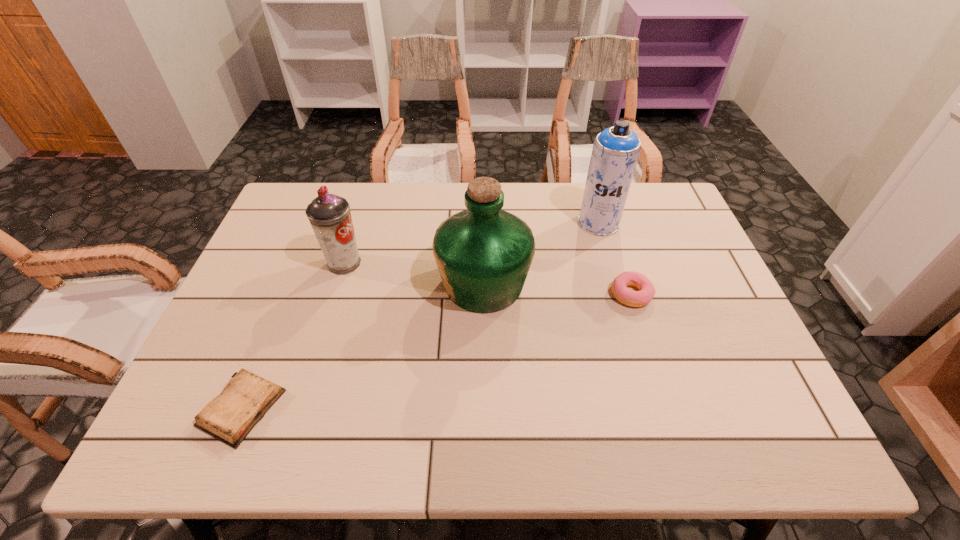
Find the location of a particular element. Image resolution: width=960 pixels, height=540 pixels. free point between the right aerosol can and the third object from right to left is located at coordinates point(541,253).

This screenshot has width=960, height=540. In order to click on free area in between the fourth tallest object and the farther aerosol can in this screenshot , I will do `click(615, 259)`.

Locate which object ranks third in proximity to the liquor. Please provide its 2D coordinates. Your answer should be formatted as a tuple, i.e. [(x, y)], where the tuple contains the x and y coordinates of a point satisfying the conditions above.

[(329, 215)]

Identify which object is the closest to the diary. Please provide its 2D coordinates. Your answer should be formatted as a tuple, i.e. [(x, y)], where the tuple contains the x and y coordinates of a point satisfying the conditions above.

[(329, 215)]

You are a GUI agent. You are given a task and a screenshot of the screen. Output one action in this format:
    pyautogui.click(x=<x>, y=<y>)
    Task: Click on the free point that satisfies the following two spatial constraints: 1. on the front side of the right aerosol can; 2. on the label side of the third object from right to left
    This screenshot has height=540, width=960.
    Given the screenshot: What is the action you would take?
    pyautogui.click(x=616, y=284)

Where is `vacant space that satisfies the following two spatial constraints: 1. on the back side of the doughnut; 2. on the left side of the nearest object`? The image size is (960, 540). vacant space that satisfies the following two spatial constraints: 1. on the back side of the doughnut; 2. on the left side of the nearest object is located at coordinates (288, 294).

Image resolution: width=960 pixels, height=540 pixels. I want to click on free point that satisfies the following two spatial constraints: 1. on the back side of the second shortest object; 2. on the label side of the third object from left to right, so click(628, 284).

Find the location of a particular element. The height and width of the screenshot is (540, 960). blank area in the image that satisfies the following two spatial constraints: 1. on the front side of the right aerosol can; 2. on the left side of the fourth tallest object is located at coordinates (620, 294).

The width and height of the screenshot is (960, 540). Identify the location of free location that satisfies the following two spatial constraints: 1. on the back side of the farthest object; 2. on the right side of the shorter aerosol can. (356, 222).

This screenshot has height=540, width=960. Identify the location of free region that satisfies the following two spatial constraints: 1. on the label side of the doughnut; 2. on the right side of the liquor. (484, 294).